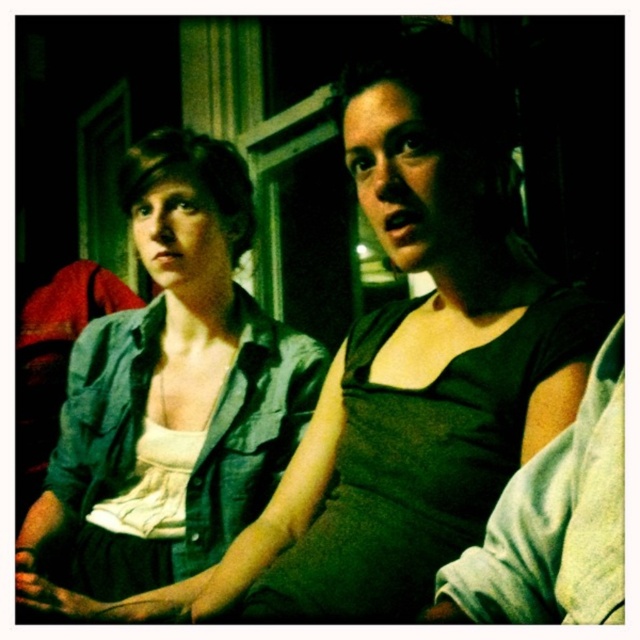
Question: Considering the relative positions of denim shirt at left and dark green fabric at center in the image provided, where is denim shirt at left located with respect to dark green fabric at center?

Choices:
 (A) below
 (B) above

Answer: (B)

Question: Does denim shirt at left appear under dark green fabric at center?

Choices:
 (A) no
 (B) yes

Answer: (A)

Question: Which of the following is the closest to the observer?

Choices:
 (A) dark green fabric at center
 (B) denim shirt at left

Answer: (A)

Question: Is denim shirt at left to the right of dark green fabric at center from the viewer's perspective?

Choices:
 (A) yes
 (B) no

Answer: (B)